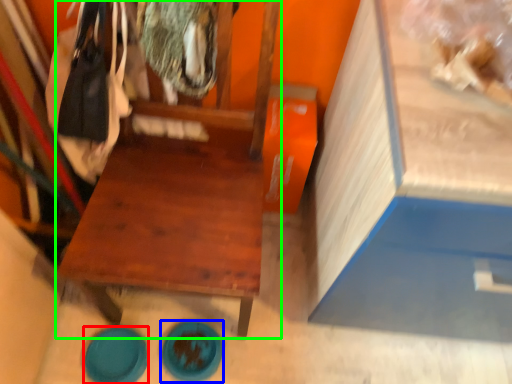
Question: Which object is the farthest from plate (highlighted by a red box)? Choose among these: plate (highlighted by a blue box) or furniture (highlighted by a green box).

Choices:
 (A) plate
 (B) furniture

Answer: (B)